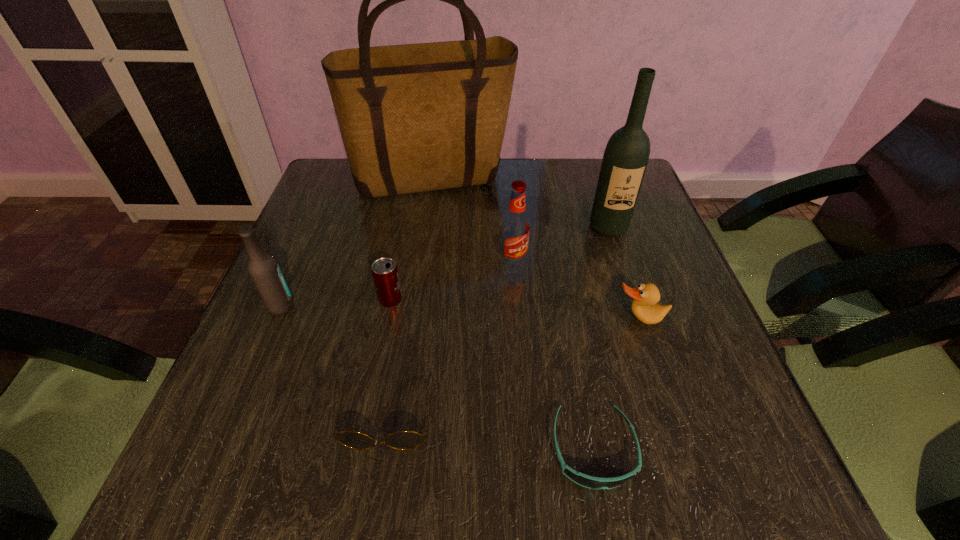
Locate an element on the screen. object that stands as the fifth closest to the second tallest object is located at coordinates (384, 270).

Locate which object ranks fourth in proximity to the duck. Please provide its 2D coordinates. Your answer should be formatted as a tuple, i.e. [(x, y)], where the tuple contains the x and y coordinates of a point satisfying the conditions above.

[(402, 440)]